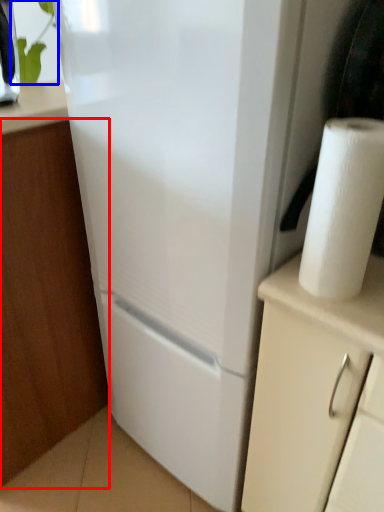
Question: Which object is further to the camera taking this photo, cabinetry (highlighted by a red box) or plant (highlighted by a blue box)?

Choices:
 (A) cabinetry
 (B) plant

Answer: (B)